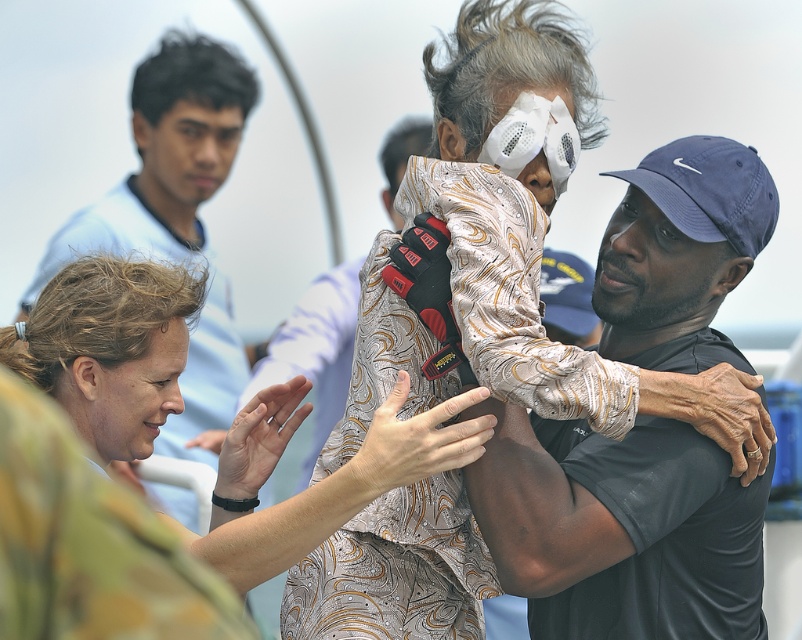
Question: Does light blue shirt at upper left have a lesser width compared to batik shirt at center?

Choices:
 (A) yes
 (B) no

Answer: (B)

Question: Is light blue shirt at upper left above batik shirt at center?

Choices:
 (A) yes
 (B) no

Answer: (A)

Question: Which of the following is the farthest from the observer?

Choices:
 (A) (323, 536)
 (B) (213, 292)

Answer: (B)

Question: Is dark blue cotton t-shirt at center below light blue shirt at upper left?

Choices:
 (A) no
 (B) yes

Answer: (B)

Question: Which object appears farthest from the camera in this image?

Choices:
 (A) matte floral dress at center
 (B) batik shirt at center

Answer: (B)

Question: Which of these objects is positioned farthest from the dark blue cotton t-shirt at center?

Choices:
 (A) light blue shirt at upper left
 (B) batik shirt at center

Answer: (B)